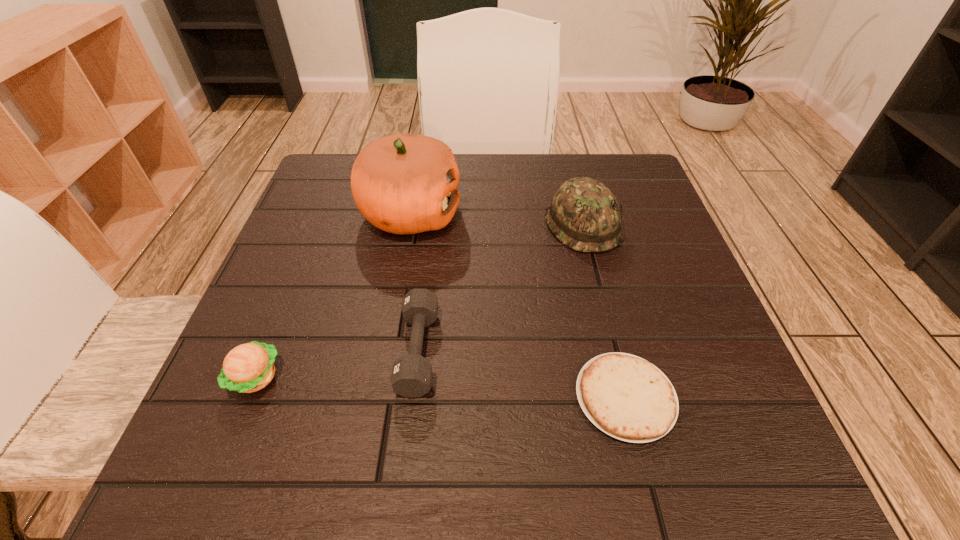
Where is `the tallest object`? The image size is (960, 540). the tallest object is located at coordinates (406, 184).

I want to click on the second tallest object, so click(x=584, y=215).

Image resolution: width=960 pixels, height=540 pixels. I want to click on hamburger, so click(247, 368).

This screenshot has height=540, width=960. I want to click on dumbbell, so click(411, 376).

Where is `tortilla`? This screenshot has width=960, height=540. tortilla is located at coordinates (625, 396).

This screenshot has height=540, width=960. In order to click on free location located 0.060m on the face of the pumpkin in this screenshot , I will do `click(488, 214)`.

I want to click on vacant space positioned 0.370m on the front of the headwear, so click(636, 431).

At what (x,y) coordinates should I click in order to perform the action: click on free space located on the back of the leftmost object. Please return your answer as a coordinate pair (x, y). Looking at the image, I should click on (291, 289).

This screenshot has width=960, height=540. Find the location of `blank space located 0.180m on the right of the dumbbell`. blank space located 0.180m on the right of the dumbbell is located at coordinates (544, 350).

Identify the location of free point located 0.380m on the left of the tortilla. (325, 397).